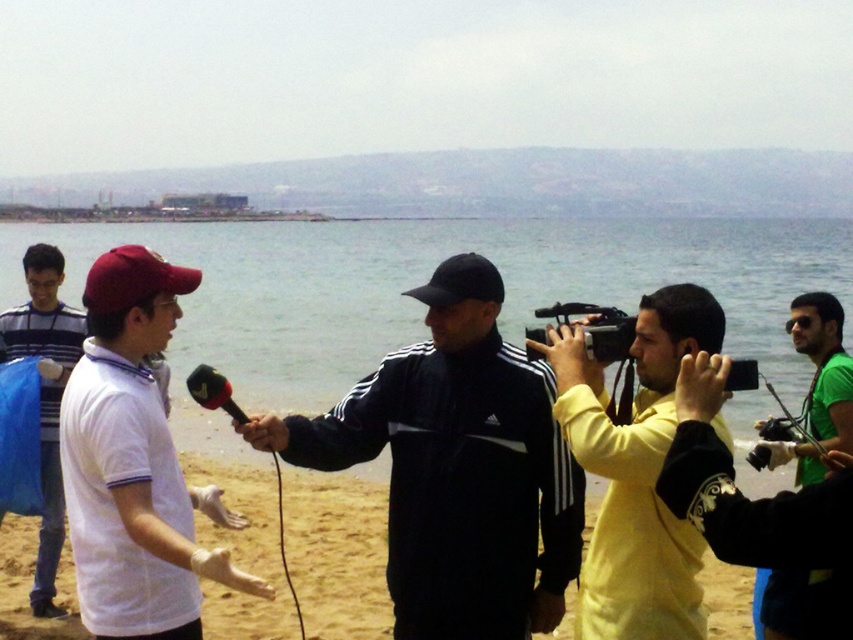
Is yellow fleece jacket at center behind black matte microphone at center?

No, it is in front of black matte microphone at center.

What do you see at coordinates (635, 468) in the screenshot? The width and height of the screenshot is (853, 640). I see `yellow fleece jacket at center` at bounding box center [635, 468].

I want to click on yellow fleece jacket at center, so click(635, 468).

Can you confirm if black matte jacket at center is taller than black matte microphone at center?

Correct, black matte jacket at center is much taller as black matte microphone at center.

Does black matte jacket at center have a lesser width compared to black matte microphone at center?

Incorrect, black matte jacket at center's width is not less than black matte microphone at center's.

Describe the element at coordinates (461, 468) in the screenshot. I see `black matte jacket at center` at that location.

Where is `black matte jacket at center`? The width and height of the screenshot is (853, 640). black matte jacket at center is located at coordinates (461, 468).

Consider the image. Which is more to the left, yellow fleece jacket at center or smooth black microphone at center?

smooth black microphone at center

Can you confirm if yellow fleece jacket at center is positioned below smooth black microphone at center?

Indeed, yellow fleece jacket at center is positioned under smooth black microphone at center.

Which is behind, point (633, 531) or point (251, 440)?

The point (251, 440) is more distant.

Locate an element on the screen. The image size is (853, 640). yellow fleece jacket at center is located at coordinates (635, 468).